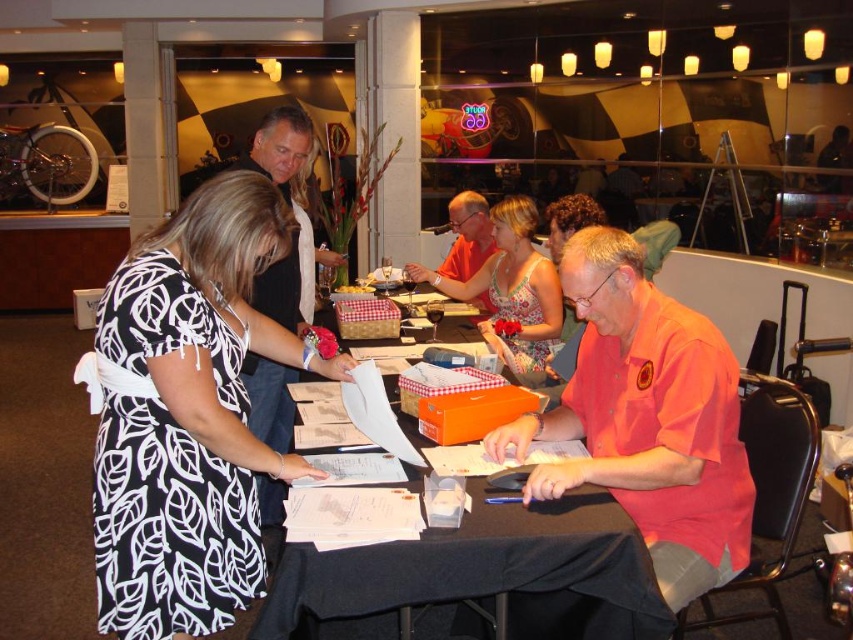
Which is behind, point (248, 584) or point (595, 317)?

Positioned behind is point (595, 317).

Which is in front, point (233, 365) or point (691, 355)?

Point (233, 365)

Is point (184, 508) closer to viewer compared to point (579, 314)?

Yes, it is.

You are a GUI agent. You are given a task and a screenshot of the screen. Output one action in this format:
    pyautogui.click(x=<x>, y=<y>)
    Task: Click on the black printed dress at center
    The width and height of the screenshot is (853, 640).
    Given the screenshot: What is the action you would take?
    (187, 413)

Identify the location of black printed dress at center. (187, 413).

Between point (160, 234) and point (544, 348), which one is positioned in front?

Point (160, 234) is in front.

Locate an element on the screen. The height and width of the screenshot is (640, 853). black printed dress at center is located at coordinates (187, 413).

Can you confirm if black paper at center is positioned to the left of floral dress at center?

Correct, you'll find black paper at center to the left of floral dress at center.

Who is more distant from viewer, (519, 515) or (547, 344)?

The point (547, 344) is more distant.

Find the location of a particular element. Image resolution: width=853 pixels, height=640 pixels. black paper at center is located at coordinates (485, 572).